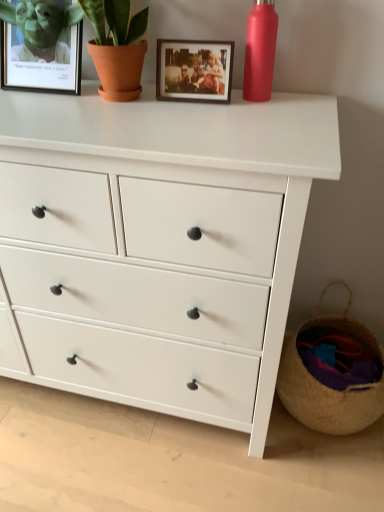
Image resolution: width=384 pixels, height=512 pixels. Find the location of `vacant space to the right of matte red bottle at upper right`. vacant space to the right of matte red bottle at upper right is located at coordinates (301, 97).